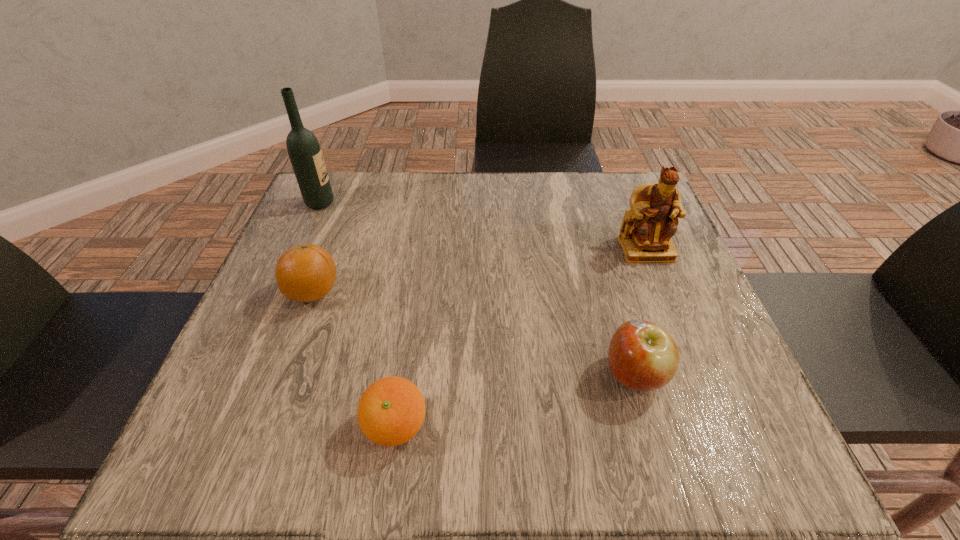
Where is `the farthest object`? The width and height of the screenshot is (960, 540). the farthest object is located at coordinates (304, 151).

I want to click on the tallest object, so click(x=304, y=151).

Locate an element on the screen. The height and width of the screenshot is (540, 960). figurine is located at coordinates (645, 235).

Image resolution: width=960 pixels, height=540 pixels. Find the location of `the second tallest object`. the second tallest object is located at coordinates pyautogui.click(x=645, y=235).

The height and width of the screenshot is (540, 960). I want to click on the third nearest object, so click(304, 273).

Locate an element on the screen. Image resolution: width=960 pixels, height=540 pixels. the farther orange is located at coordinates (304, 273).

Identify the location of apple. (643, 356).

At what (x,y) coordinates should I click in order to perform the action: click on the right orange. Please return your answer as a coordinate pair (x, y). Looking at the image, I should click on (391, 411).

This screenshot has height=540, width=960. Identify the location of the third object from right to left. (391, 411).

Locate an element on the screen. This screenshot has height=540, width=960. vacant space located on the labeled side of the farthest object is located at coordinates (377, 203).